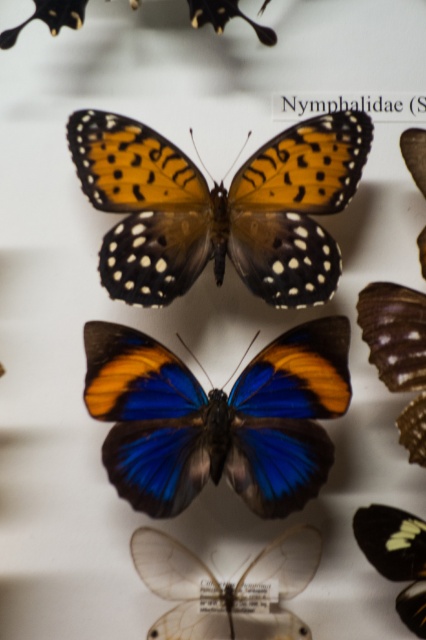
Does shiny blue butterfly at center appear over transparent plastic wings at center?

Indeed, shiny blue butterfly at center is positioned over transparent plastic wings at center.

How far apart are shiny blue butterfly at center and transparent plastic wings at center?

shiny blue butterfly at center is 19.06 centimeters away from transparent plastic wings at center.

The width and height of the screenshot is (426, 640). I want to click on shiny blue butterfly at center, so click(218, 417).

Is point (270, 390) more distant than point (368, 524)?

Yes.

Find the location of a particular element. The height and width of the screenshot is (640, 426). shiny blue butterfly at center is located at coordinates (218, 417).

Is point (207, 404) farther from viewer compared to point (403, 589)?

Yes, it is behind point (403, 589).

In order to click on shiny blue butterfly at center in this screenshot , I will do `click(218, 417)`.

Who is taller, orange-patterned butterfly at center or translucent white butterfly at lower right?

orange-patterned butterfly at center is taller.

Who is higher up, orange-patterned butterfly at center or translucent white butterfly at lower right?

orange-patterned butterfly at center is higher up.

Is point (88, 179) less distant than point (368, 557)?

No, it is behind (368, 557).

Where is `orange-patterned butterfly at center`? This screenshot has height=640, width=426. orange-patterned butterfly at center is located at coordinates (218, 208).